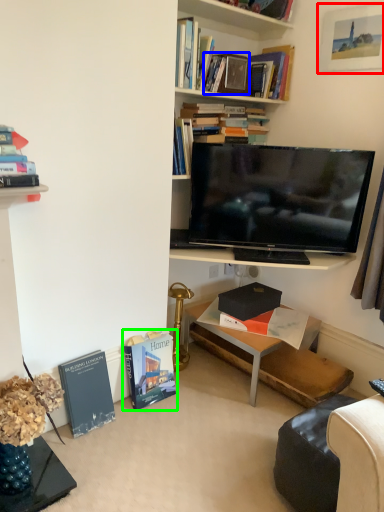
Question: Which object is the farthest from picture frame (highlighted by a red box)? Choose among these: book (highlighted by a blue box) or book (highlighted by a green box).

Choices:
 (A) book
 (B) book

Answer: (B)